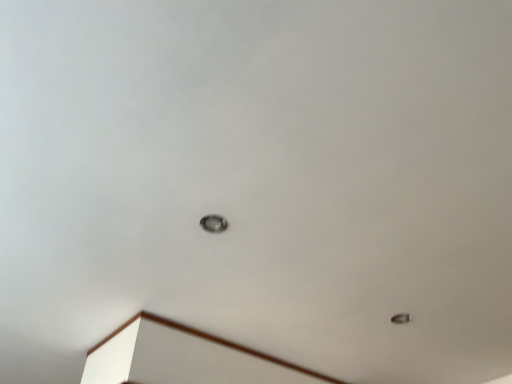
Question: Is satin silver lamp at center, which appears as the second lamp when viewed from the right, further to camera compared to metallic ring at lower right, positioned as the second lamp in left-to-right order?

Choices:
 (A) yes
 (B) no

Answer: (B)

Question: From a real-world perspective, is satin silver lamp at center, which is the second lamp in back-to-front order, positioned under metallic ring at lower right, the first lamp from the bottom, based on gravity?

Choices:
 (A) yes
 (B) no

Answer: (B)

Question: From a real-world perspective, is satin silver lamp at center, positioned as the 1th lamp in left-to-right order, on top of metallic ring at lower right, positioned as the second lamp in left-to-right order?

Choices:
 (A) no
 (B) yes

Answer: (B)

Question: From the image's perspective, would you say satin silver lamp at center, which appears as the second lamp when viewed from the right, is shown under metallic ring at lower right, which ranks as the first lamp in back-to-front order?

Choices:
 (A) no
 (B) yes

Answer: (A)

Question: Is satin silver lamp at center, positioned as the 1th lamp in left-to-right order, to the left of metallic ring at lower right, which ranks as the first lamp in back-to-front order, from the viewer's perspective?

Choices:
 (A) no
 (B) yes

Answer: (B)

Question: Is satin silver lamp at center, placed as the second lamp when sorted from bottom to top, oriented towards metallic ring at lower right, which ranks as the 2th lamp in top-to-bottom order?

Choices:
 (A) no
 (B) yes

Answer: (B)

Question: From a real-world perspective, does metallic ring at lower right, the second lamp from the front, sit lower than satin silver lamp at center, positioned as the 1th lamp in left-to-right order?

Choices:
 (A) yes
 (B) no

Answer: (A)

Question: Does metallic ring at lower right, the first lamp from the bottom, have a greater width compared to satin silver lamp at center, positioned as the 1th lamp in left-to-right order?

Choices:
 (A) yes
 (B) no

Answer: (B)

Question: Does metallic ring at lower right, positioned as the first lamp in right-to-left order, contain satin silver lamp at center, placed as the 1th lamp when sorted from front to back?

Choices:
 (A) no
 (B) yes

Answer: (A)

Question: Considering the relative sizes of metallic ring at lower right, the second lamp from the front, and satin silver lamp at center, placed as the 1th lamp when sorted from front to back, in the image provided, is metallic ring at lower right, the second lamp from the front, taller than satin silver lamp at center, placed as the 1th lamp when sorted from front to back,?

Choices:
 (A) yes
 (B) no

Answer: (B)

Question: From a real-world perspective, is metallic ring at lower right, the second lamp from the front, located higher than satin silver lamp at center, which is the second lamp in back-to-front order?

Choices:
 (A) yes
 (B) no

Answer: (B)

Question: From a real-world perspective, is satin silver lamp at center, placed as the second lamp when sorted from bottom to top, physically located above or below metallic ring at lower right, the second lamp from the front?

Choices:
 (A) above
 (B) below

Answer: (A)